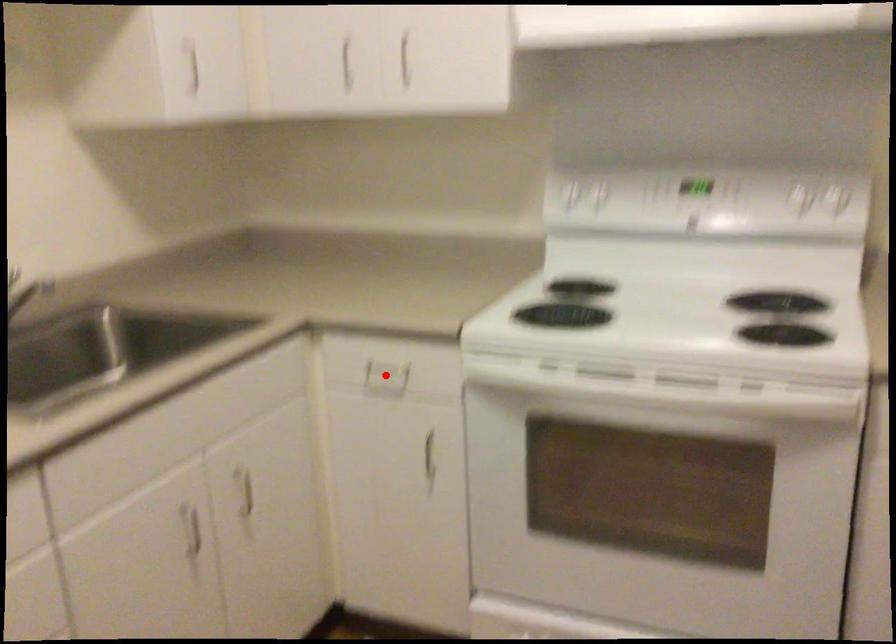
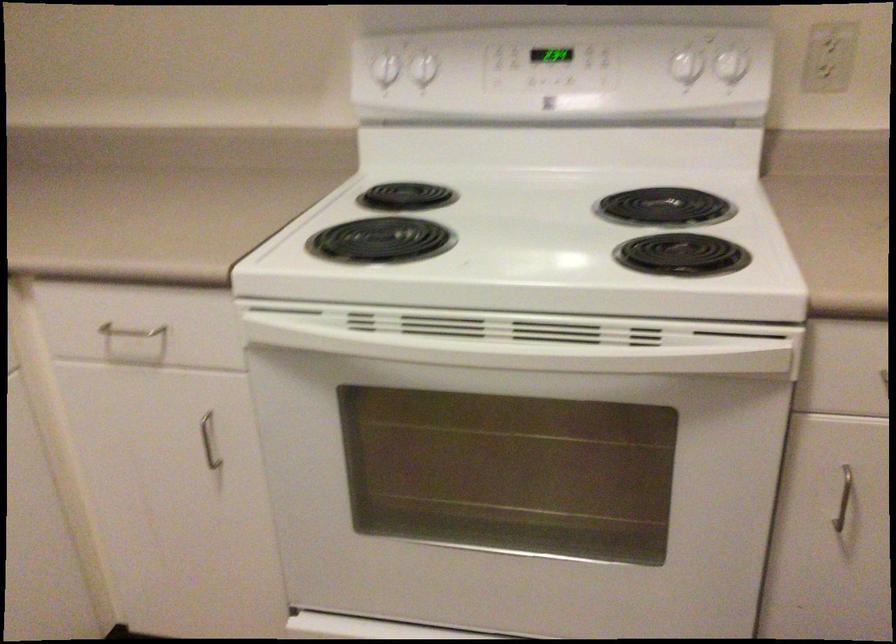
Question: A red point is marked in image1. In image2, is the corresponding 3D point closer to the camera or farther? Reply with the corresponding letter.

Choices:
 (A) The corresponding 3D point is closer.
 (B) The corresponding 3D point is farther.

Answer: (A)